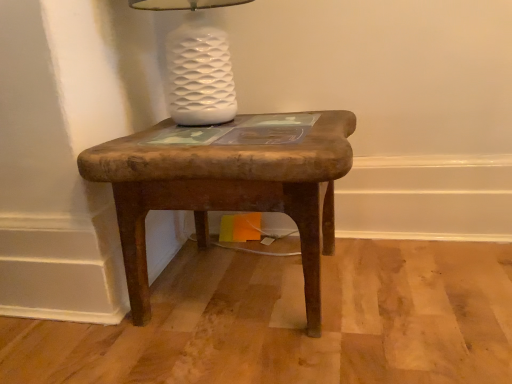
Image resolution: width=512 pixels, height=384 pixels. Identify the location of free spot to the right of white glossy lamp at upper center. (301, 121).